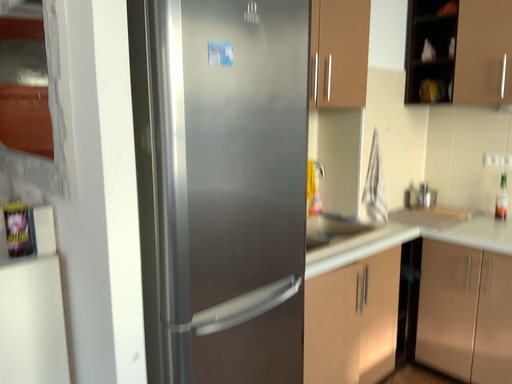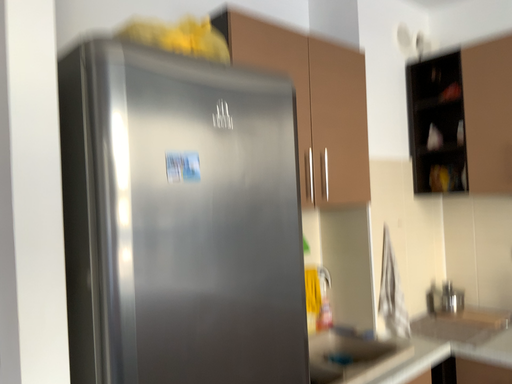
Question: How did the camera likely rotate when shooting the video?

Choices:
 (A) rotated downward
 (B) rotated upward

Answer: (B)